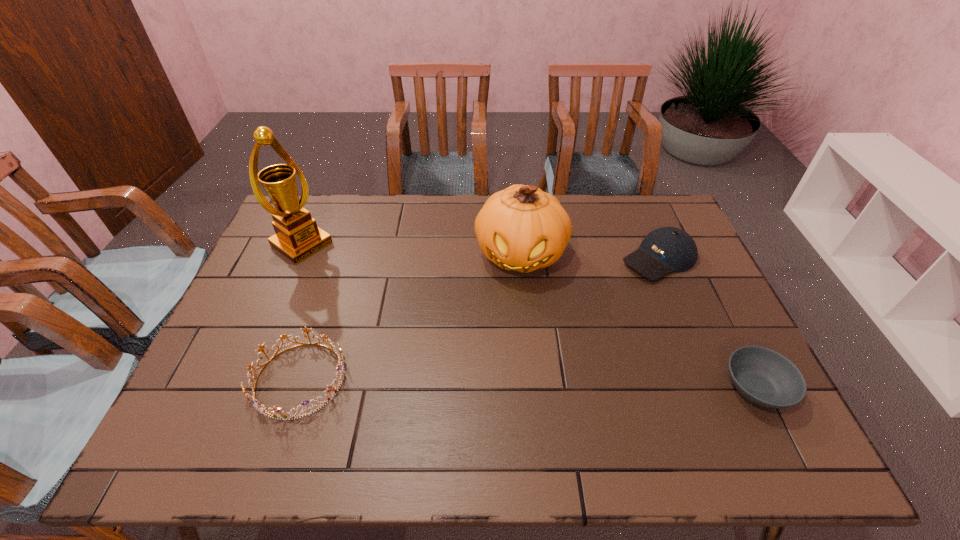
Locate an element on the screen. soup bowl present at the near edge is located at coordinates (764, 377).

The width and height of the screenshot is (960, 540). Identify the location of tiara located in the left edge section of the desktop. (275, 412).

Find the location of a particular element. award located in the left edge section of the desktop is located at coordinates (297, 237).

Locate an element on the screen. soup bowl at the right edge is located at coordinates (764, 377).

Locate an element on the screen. This screenshot has width=960, height=540. baseball cap that is at the right edge is located at coordinates (667, 249).

Locate an element on the screen. The width and height of the screenshot is (960, 540). object located at the far left corner is located at coordinates (297, 237).

Where is `object located in the near left corner section of the desktop`? object located in the near left corner section of the desktop is located at coordinates (275, 412).

This screenshot has height=540, width=960. What are the coordinates of `object positioned at the far right corner` in the screenshot? It's located at (667, 249).

This screenshot has width=960, height=540. In order to click on object that is at the near right corner in this screenshot , I will do `click(764, 377)`.

This screenshot has width=960, height=540. In the image, there is a desktop. Identify the location of vacant area at the far edge. (437, 219).